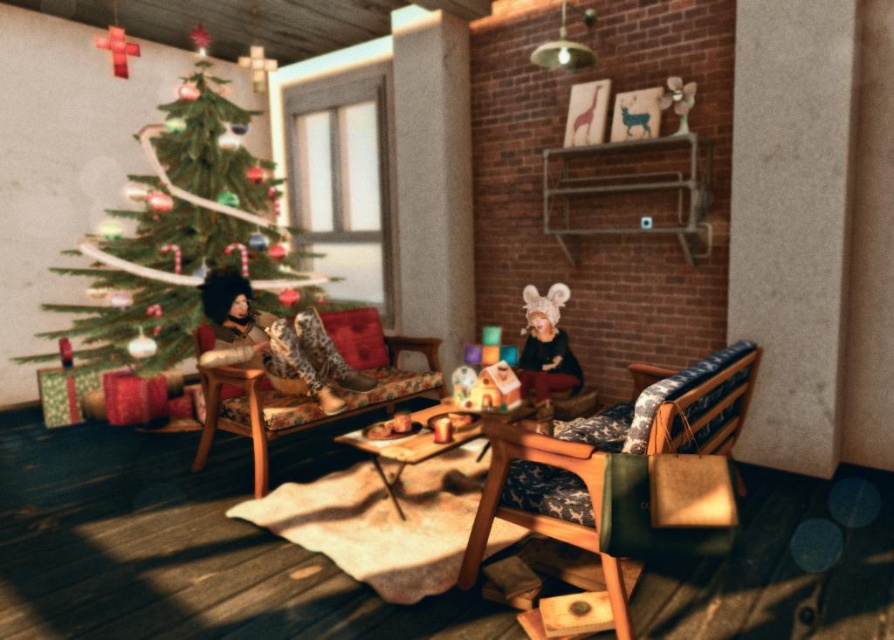
This screenshot has width=894, height=640. What do you see at coordinates (252, 412) in the screenshot?
I see `wooden armchair at left` at bounding box center [252, 412].

Is point (228, 387) positioned before point (358, 429)?

No, it is behind (358, 429).

Which is behind, point (422, 390) or point (448, 417)?

The point (422, 390) is more distant.

Locate an element on the screen. Image resolution: width=894 pixels, height=640 pixels. wooden armchair at left is located at coordinates (252, 412).

Does green matte christmas tree at left appear on the right side of leather boots at left?

No, green matte christmas tree at left is not to the right of leather boots at left.

Between green matte christmas tree at left and leather boots at left, which one has more height?

Standing taller between the two is green matte christmas tree at left.

Image resolution: width=894 pixels, height=640 pixels. I want to click on green matte christmas tree at left, so click(x=184, y=230).

Which is behind, point (375, 314) or point (521, 291)?

The point (521, 291) is behind.

Where is `wooden armchair at left`? The width and height of the screenshot is (894, 640). wooden armchair at left is located at coordinates (252, 412).

Between point (263, 484) and point (542, 360), which one is positioned behind?

Point (542, 360)

Find the location of a particular element. wooden armchair at left is located at coordinates (252, 412).